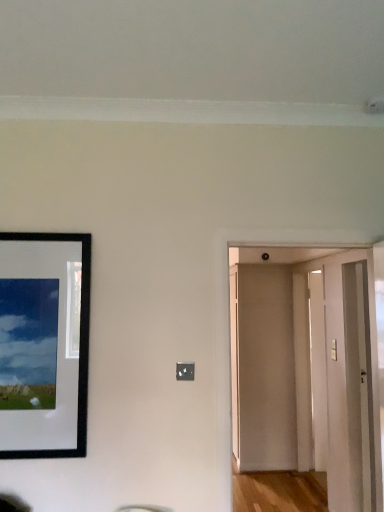
Question: Is black matte picture frame at left behind transparent glass door at right?

Choices:
 (A) no
 (B) yes

Answer: (A)

Question: Is black matte picture frame at left aimed at transparent glass door at right?

Choices:
 (A) no
 (B) yes

Answer: (A)

Question: Would you say black matte picture frame at left contains transparent glass door at right?

Choices:
 (A) no
 (B) yes

Answer: (A)

Question: Is black matte picture frame at left facing away from transparent glass door at right?

Choices:
 (A) yes
 (B) no

Answer: (B)

Question: Is there a large distance between black matte picture frame at left and transparent glass door at right?

Choices:
 (A) yes
 (B) no

Answer: (A)

Question: Considering the relative positions of black matte picture frame at left and transparent glass door at right in the image provided, is black matte picture frame at left to the left of transparent glass door at right from the viewer's perspective?

Choices:
 (A) no
 (B) yes

Answer: (B)

Question: Can you see white wooden door at center, which is counted as the 1th door, starting from the front, touching transparent glass door at right?

Choices:
 (A) no
 (B) yes

Answer: (A)

Question: Can transparent glass door at right be found inside white wooden door at center, the 3th door in the back-to-front sequence?

Choices:
 (A) no
 (B) yes

Answer: (A)

Question: Is white wooden door at center, the 3th door in the back-to-front sequence, bigger than transparent glass door at right?

Choices:
 (A) yes
 (B) no

Answer: (A)

Question: Considering the relative sizes of white wooden door at center, which is counted as the 1th door, starting from the front, and transparent glass door at right in the image provided, is white wooden door at center, which is counted as the 1th door, starting from the front, taller than transparent glass door at right?

Choices:
 (A) no
 (B) yes

Answer: (A)

Question: Considering the relative sizes of white wooden door at center, which is counted as the 1th door, starting from the front, and transparent glass door at right in the image provided, is white wooden door at center, which is counted as the 1th door, starting from the front, wider than transparent glass door at right?

Choices:
 (A) yes
 (B) no

Answer: (A)

Question: From the image's perspective, is white wooden door at center, which is counted as the 1th door, starting from the front, located above transparent glass door at right?

Choices:
 (A) yes
 (B) no

Answer: (A)

Question: Could you tell me if black matte picture frame at left is turned towards beige matte door at center, placed as the 1th door when sorted from back to front?

Choices:
 (A) yes
 (B) no

Answer: (B)